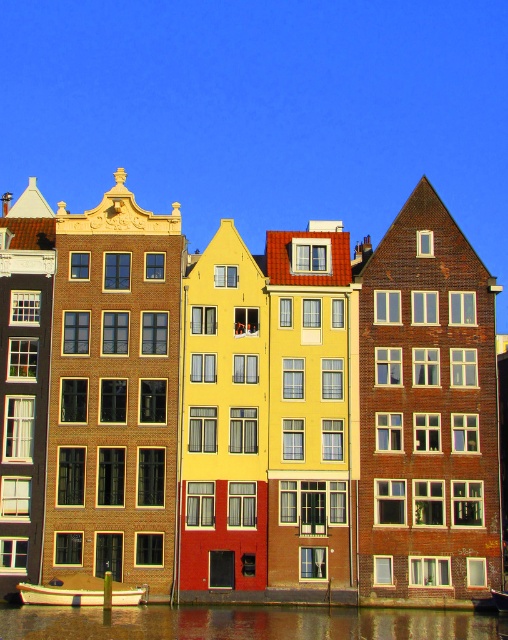
Between point (434, 611) and point (35, 588), which one is positioned in front?

Point (35, 588)

Does smooth reflective water at lower center have a smaller size compared to white glossy boat at lower left?

Actually, smooth reflective water at lower center might be larger than white glossy boat at lower left.

At what (x,y) coordinates should I click in order to perform the action: click on smooth reflective water at lower center. Please return your answer as a coordinate pair (x, y). The width and height of the screenshot is (508, 640). Looking at the image, I should click on (246, 624).

Locate an element on the screen. The height and width of the screenshot is (640, 508). smooth reflective water at lower center is located at coordinates (246, 624).